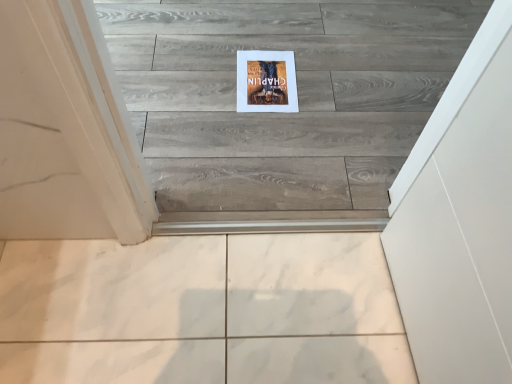
Question: Is white marble tile at lower center smaller than matte cardboard poster at center?

Choices:
 (A) yes
 (B) no

Answer: (B)

Question: Does white marble tile at lower center lie behind matte cardboard poster at center?

Choices:
 (A) no
 (B) yes

Answer: (A)

Question: Is white marble tile at lower center shorter than matte cardboard poster at center?

Choices:
 (A) yes
 (B) no

Answer: (B)

Question: Can matte cardboard poster at center be found inside white marble tile at lower center?

Choices:
 (A) yes
 (B) no

Answer: (B)

Question: Is white marble tile at lower center outside of matte cardboard poster at center?

Choices:
 (A) no
 (B) yes

Answer: (B)

Question: Is white marble tile at lower center to the left of matte cardboard poster at center from the viewer's perspective?

Choices:
 (A) yes
 (B) no

Answer: (A)

Question: Is matte cardboard poster at center located outside white marble tile at lower center?

Choices:
 (A) yes
 (B) no

Answer: (A)

Question: Can you confirm if matte cardboard poster at center is thinner than white marble tile at lower center?

Choices:
 (A) no
 (B) yes

Answer: (B)

Question: Is matte cardboard poster at center positioned with its back to white marble tile at lower center?

Choices:
 (A) no
 (B) yes

Answer: (A)

Question: Does matte cardboard poster at center touch white marble tile at lower center?

Choices:
 (A) yes
 (B) no

Answer: (B)

Question: Considering the relative positions of matte cardboard poster at center and white marble tile at lower center in the image provided, is matte cardboard poster at center to the right of white marble tile at lower center from the viewer's perspective?

Choices:
 (A) no
 (B) yes

Answer: (B)

Question: Is matte cardboard poster at center smaller than white marble tile at lower center?

Choices:
 (A) no
 (B) yes

Answer: (B)

Question: Would you say matte cardboard poster at center is to the left or to the right of white marble tile at lower center in the picture?

Choices:
 (A) right
 (B) left

Answer: (A)